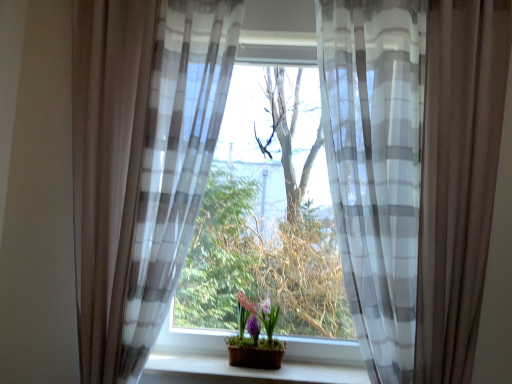
Question: Is sheer white and gray striped curtain at center, which is the first curtain in right-to-left order, located outside matte purple pot at center?

Choices:
 (A) no
 (B) yes

Answer: (B)

Question: Considering the relative sizes of sheer white and gray striped curtain at center, which is the first curtain in right-to-left order, and matte purple pot at center in the image provided, is sheer white and gray striped curtain at center, which is the first curtain in right-to-left order, wider than matte purple pot at center?

Choices:
 (A) yes
 (B) no

Answer: (A)

Question: Is sheer white and gray striped curtain at center, which is the first curtain in right-to-left order, at the left side of matte purple pot at center?

Choices:
 (A) yes
 (B) no

Answer: (B)

Question: Considering the relative sizes of sheer white and gray striped curtain at center, which is the first curtain in right-to-left order, and matte purple pot at center in the image provided, is sheer white and gray striped curtain at center, which is the first curtain in right-to-left order, smaller than matte purple pot at center?

Choices:
 (A) yes
 (B) no

Answer: (B)

Question: Would you consider sheer white and gray striped curtain at center, which is the first curtain in right-to-left order, to be distant from matte purple pot at center?

Choices:
 (A) no
 (B) yes

Answer: (A)

Question: Looking at their shapes, would you say translucent fabric at center is wider or thinner than matte purple pot at center?

Choices:
 (A) wide
 (B) thin

Answer: (A)

Question: Does point [x=335, y=253] appear closer or farther from the camera than point [x=275, y=352]?

Choices:
 (A) farther
 (B) closer

Answer: (A)

Question: Considering the positions of translucent fabric at center and matte purple pot at center in the image, is translucent fabric at center bigger or smaller than matte purple pot at center?

Choices:
 (A) big
 (B) small

Answer: (A)

Question: In the image, is translucent fabric at center on the left side or the right side of matte purple pot at center?

Choices:
 (A) left
 (B) right

Answer: (B)

Question: In the image, is sheer gray-white striped curtain at left, which appears as the second curtain when viewed from the right, positioned in front of or behind wooden at center?

Choices:
 (A) front
 (B) behind

Answer: (A)

Question: Considering the positions of sheer gray-white striped curtain at left, which appears as the second curtain when viewed from the right, and wooden at center in the image, is sheer gray-white striped curtain at left, which appears as the second curtain when viewed from the right, wider or thinner than wooden at center?

Choices:
 (A) wide
 (B) thin

Answer: (A)

Question: From the image's perspective, relative to wooden at center, is sheer gray-white striped curtain at left, the 1th curtain when ordered from left to right, above or below?

Choices:
 (A) above
 (B) below

Answer: (A)

Question: Visually, is sheer gray-white striped curtain at left, the 1th curtain when ordered from left to right, positioned to the left or to the right of wooden at center?

Choices:
 (A) left
 (B) right

Answer: (A)

Question: Based on their positions, is wooden at center located to the left or right of translucent fabric at center?

Choices:
 (A) left
 (B) right

Answer: (A)

Question: In the image, is wooden at center positioned in front of or behind translucent fabric at center?

Choices:
 (A) front
 (B) behind

Answer: (A)